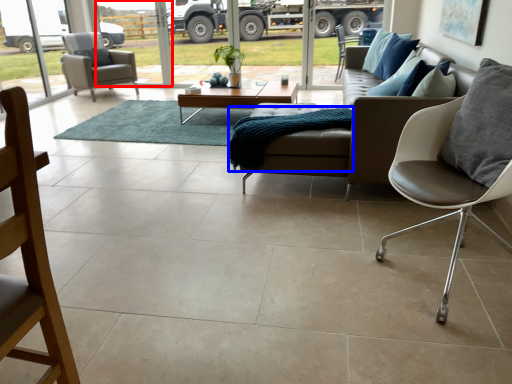
Question: Which object appears farthest to the camera in this image, window screen (highlighted by a red box) or blanket (highlighted by a blue box)?

Choices:
 (A) window screen
 (B) blanket

Answer: (A)